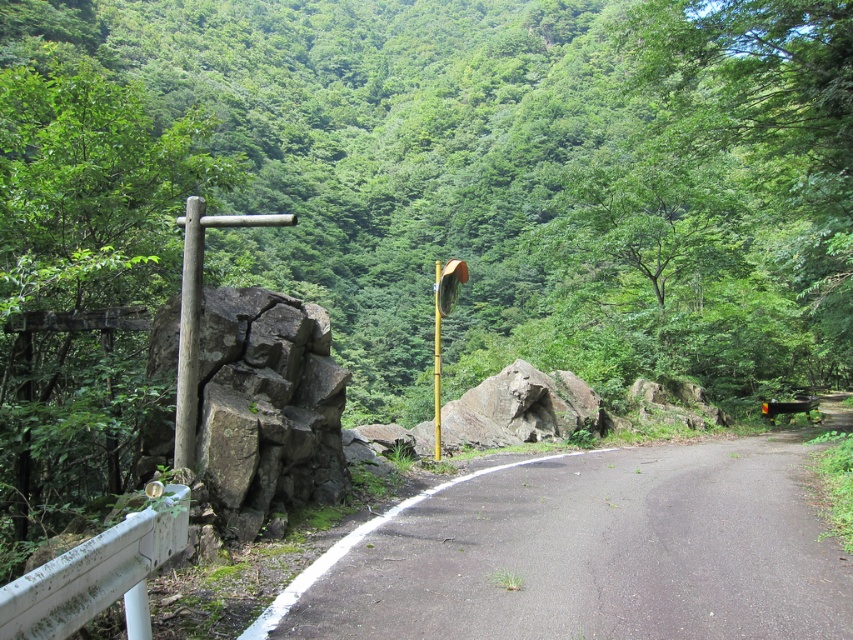
Between smooth wooden post at left and gold metallic street sign at center, which one has less height?

Standing shorter between the two is smooth wooden post at left.

Is smooth wooden post at left below gold metallic street sign at center?

Actually, smooth wooden post at left is above gold metallic street sign at center.

Is point (190, 269) less distant than point (434, 394)?

Yes, it is.

You are a GUI agent. You are given a task and a screenshot of the screen. Output one action in this format:
    pyautogui.click(x=<x>, y=<y>)
    Task: Click on the smooth wooden post at left
    
    Given the screenshot: What is the action you would take?
    pyautogui.click(x=189, y=333)

Is point (788, 614) positioned after point (334, 493)?

No, it is not.

Which is more to the left, black asphalt road at center or dark gray rough rock at left?

From the viewer's perspective, dark gray rough rock at left appears more on the left side.

Where is `black asphalt road at center`? The width and height of the screenshot is (853, 640). black asphalt road at center is located at coordinates (589, 552).

Can you confirm if brown wooden pole at left is smaller than gold metallic pole at center?

Correct, brown wooden pole at left occupies less space than gold metallic pole at center.

Which is more to the left, brown wooden pole at left or gold metallic pole at center?

brown wooden pole at left

Who is more forward, (x=254, y=214) or (x=436, y=352)?

Point (x=254, y=214) is more forward.

Identify the location of brown wooden pole at left. This screenshot has width=853, height=640. (198, 316).